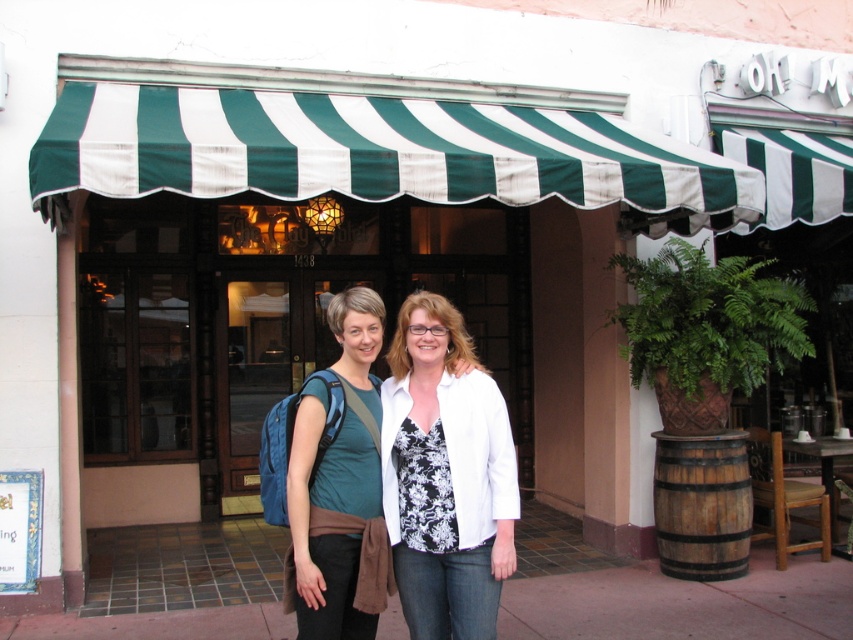
You are a photographer trying to capture a clear photo of the teal fabric shirt at center without the green striped awning at upper center blocking it. What should you do?

The teal fabric shirt at center is behind the green striped awning at upper center, so you should move your camera position forward to get a clear shot by moving closer to the teal fabric shirt at center and positioning it in front of the green striped awning at upper center.

You are standing in front of the store with the green and white striped awning. You notice two points marked in the scene. The first point is at coordinates point (218, 624) and the second is at point (480, 484). Which of these points is closer to you?

Point (218, 624) is closer to you than point (480, 484) because it is further to the viewer according to the description.

You are a tailor observing two people in front of a store with a green and white striped awning. You need to determine which clothing item is shorter between the white matte jacket at center and the teal fabric shirt at center. Which one is shorter?

The white matte jacket at center is shorter than the teal fabric shirt at center.